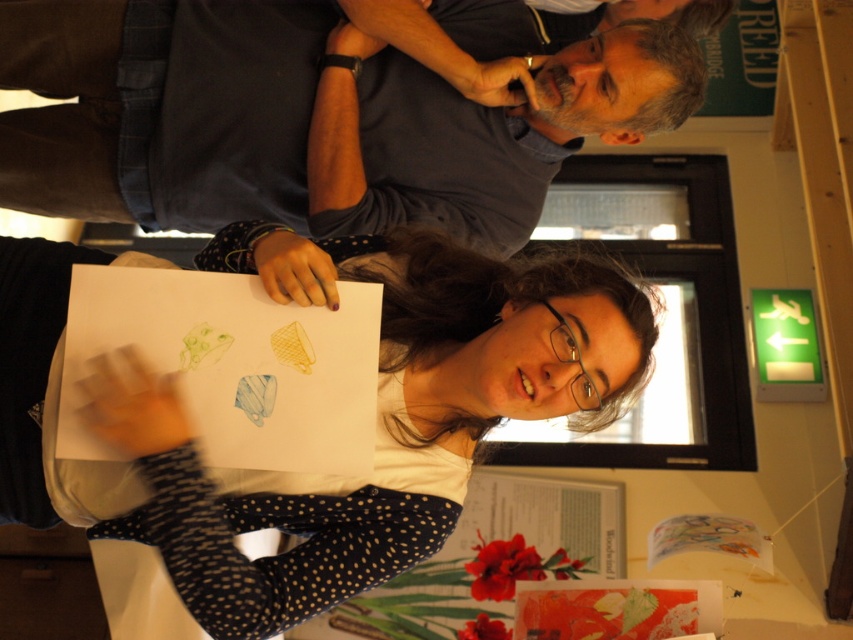
Question: Is white paper at center to the left of green illuminated sign at upper right from the viewer's perspective?

Choices:
 (A) no
 (B) yes

Answer: (B)

Question: Which point appears closest to the camera in this image?

Choices:
 (A) (606, 276)
 (B) (244, 177)

Answer: (A)

Question: Which point is farther to the camera?

Choices:
 (A) (805, 122)
 (B) (550, 81)

Answer: (A)

Question: Is dark blue shirt at upper center closer to the viewer compared to green illuminated sign at upper right?

Choices:
 (A) yes
 (B) no

Answer: (A)

Question: Estimate the real-world distances between objects in this image. Which object is farther from the green illuminated sign at upper right?

Choices:
 (A) dark blue shirt at upper center
 (B) white paper at center

Answer: (B)

Question: Is white paper at center to the right of green illuminated sign at upper right from the viewer's perspective?

Choices:
 (A) no
 (B) yes

Answer: (A)